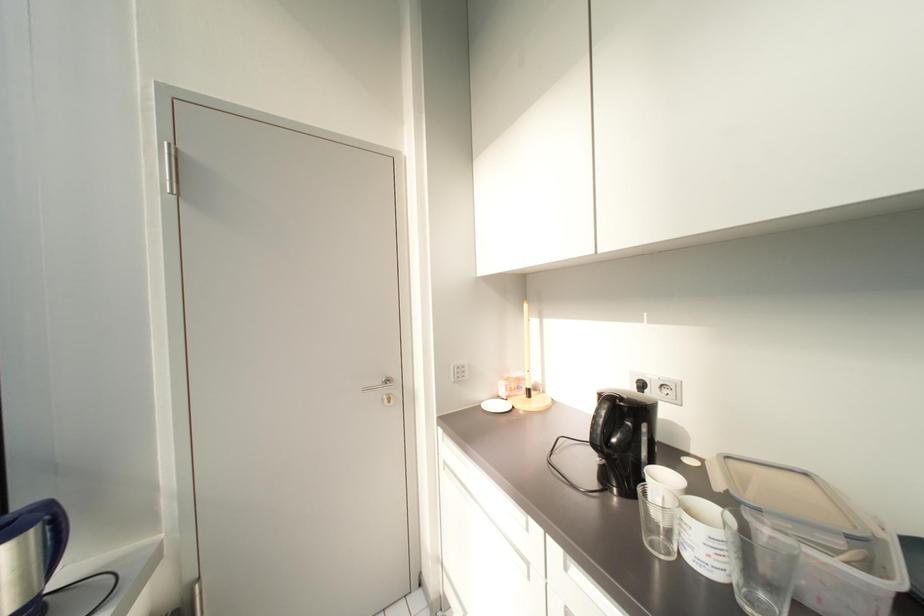
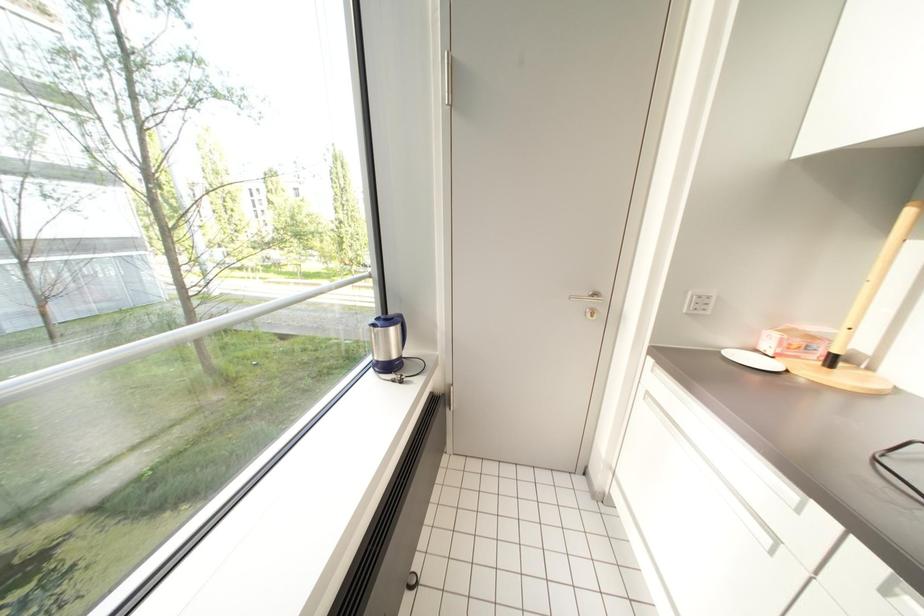
The first image is from the beginning of the video and the second image is from the end. How did the camera likely rotate when shooting the video?

The camera rotated toward left-down.